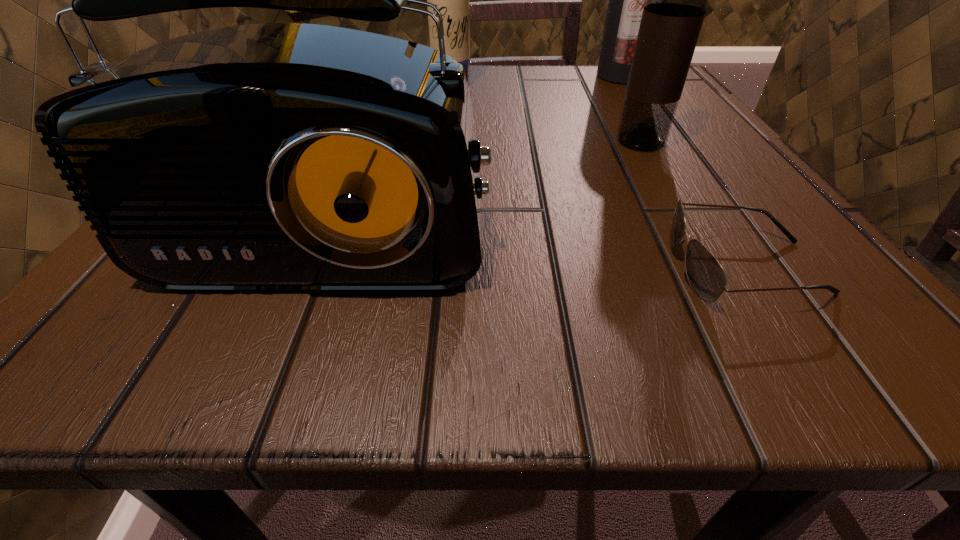
Find the location of a particular element. the leftmost wine bottle is located at coordinates (452, 0).

The height and width of the screenshot is (540, 960). In order to click on the nearest wine bottle in this screenshot , I will do `click(676, 0)`.

Where is `the second shortest object`? This screenshot has height=540, width=960. the second shortest object is located at coordinates (275, 156).

Find the location of a particular element. The height and width of the screenshot is (540, 960). sunglasses is located at coordinates (707, 278).

Image resolution: width=960 pixels, height=540 pixels. In order to click on free region located on the label of the leftmost wine bottle in this screenshot , I will do `click(435, 220)`.

The width and height of the screenshot is (960, 540). Identify the location of vacant space located on the back of the nearest wine bottle. (618, 104).

Image resolution: width=960 pixels, height=540 pixels. Identify the location of vacant space located on the front-facing side of the sunglasses. (348, 267).

Where is `vacant space located 0.160m on the front-facing side of the sunglasses`? vacant space located 0.160m on the front-facing side of the sunglasses is located at coordinates pyautogui.click(x=520, y=267).

The image size is (960, 540). In order to click on free spot located 0.100m on the front-facing side of the sunglasses in this screenshot , I will do `click(578, 267)`.

You are a GUI agent. You are given a task and a screenshot of the screen. Output one action in this format:
    pyautogui.click(x=<x>, y=<y>)
    Task: Click on the radio receiver at the near edge
    The width and height of the screenshot is (960, 540).
    Given the screenshot: What is the action you would take?
    pyautogui.click(x=275, y=156)